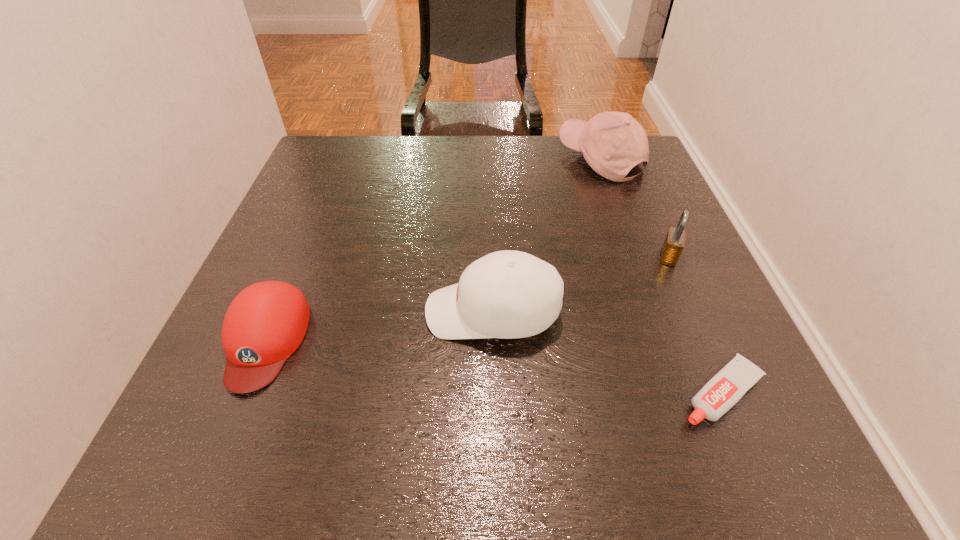
The image size is (960, 540). Identify the location of free point located on the front-facing side of the fourth object from right to left. (362, 312).

Identify the location of free space located 0.340m on the front-facing side of the fourth object from right to left. This screenshot has width=960, height=540. (244, 312).

Locate an element on the screen. The image size is (960, 540). vacant space situated on the front-facing side of the fourth object from right to left is located at coordinates (319, 312).

You are a GUI agent. You are given a task and a screenshot of the screen. Output one action in this format:
    pyautogui.click(x=<x>, y=<y>)
    Task: Click on the vacant space situated 0.240m on the left of the padlock
    
    Given the screenshot: What is the action you would take?
    pyautogui.click(x=543, y=256)

I want to click on vacant space located 0.090m on the front-facing side of the shortest baseball cap, so click(219, 453).

At what (x,y) coordinates should I click in order to perform the action: click on vacant area situated on the left of the toothpaste. Please return your answer as a coordinate pair (x, y). This screenshot has height=540, width=960. Looking at the image, I should click on (464, 393).

Find the location of a particular element. object present at the far edge is located at coordinates (612, 143).

Locate an element on the screen. The height and width of the screenshot is (540, 960). object located at the near edge is located at coordinates (727, 387).

Where is `object at the left edge`? Image resolution: width=960 pixels, height=540 pixels. object at the left edge is located at coordinates (265, 324).

Identify the location of baseball cap present at the right edge. The width and height of the screenshot is (960, 540). (612, 143).